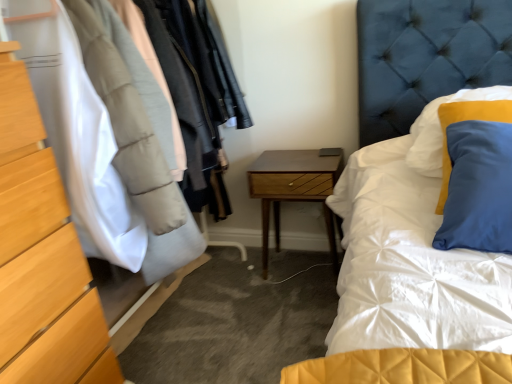
You are a GUI agent. You are given a task and a screenshot of the screen. Output one action in this format:
    pyautogui.click(x=<x>, y=<y>)
    Task: Click on the blank space to the left of woodenmaterial/texturenightstand at center
    Image resolution: width=512 pixels, height=384 pixels.
    Given the screenshot: What is the action you would take?
    pyautogui.click(x=241, y=268)